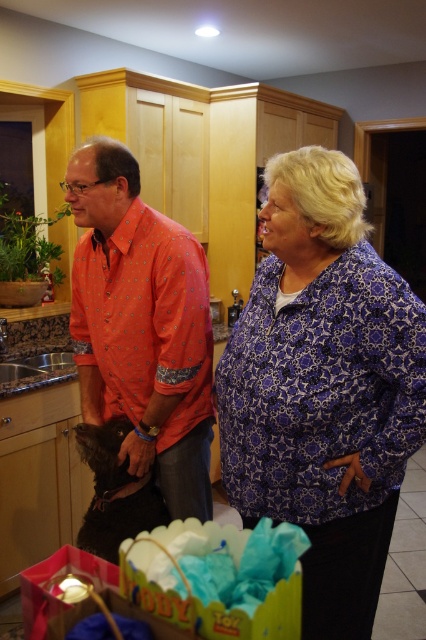
Question: Can you confirm if purple printed blouse at center is positioned to the left of orange dotted shirt at center?

Choices:
 (A) no
 (B) yes

Answer: (A)

Question: Is purple printed blouse at center thinner than orange dotted shirt at center?

Choices:
 (A) yes
 (B) no

Answer: (A)

Question: Which point is farther from the camera taking this photo?

Choices:
 (A) (416, 426)
 (B) (176, 250)

Answer: (B)

Question: Which point is closer to the camera?

Choices:
 (A) orange dotted shirt at center
 (B) purple printed blouse at center

Answer: (B)

Question: Does purple printed blouse at center have a larger size compared to orange dotted shirt at center?

Choices:
 (A) yes
 (B) no

Answer: (A)